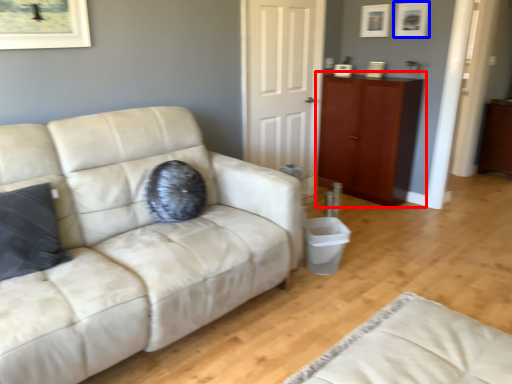
Question: Which of the following is the closest to the observer, cabinetry (highlighted by a red box) or picture frame (highlighted by a blue box)?

Choices:
 (A) cabinetry
 (B) picture frame

Answer: (A)